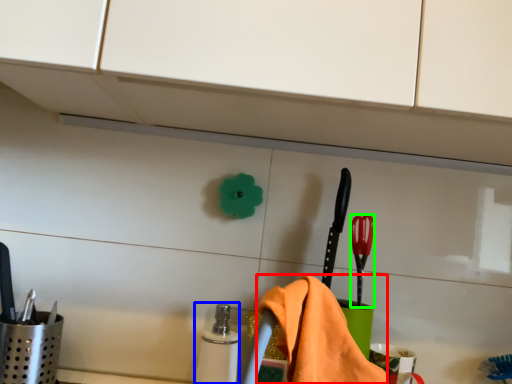
Question: Estimate the real-world distances between objects in this image. Which object is farther from bath towel (highlighted by a red box), toiletry (highlighted by a blue box) or brush (highlighted by a green box)?

Choices:
 (A) toiletry
 (B) brush

Answer: (A)